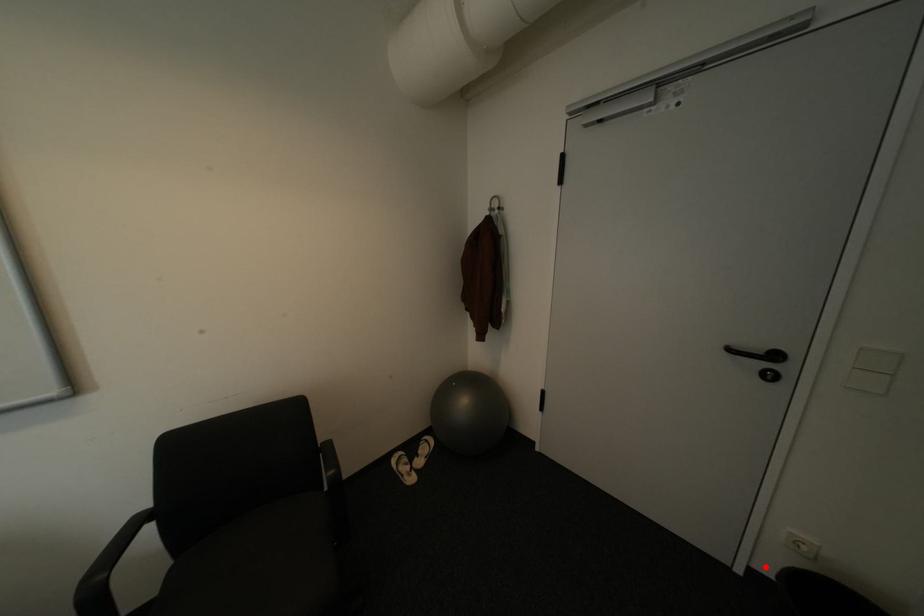
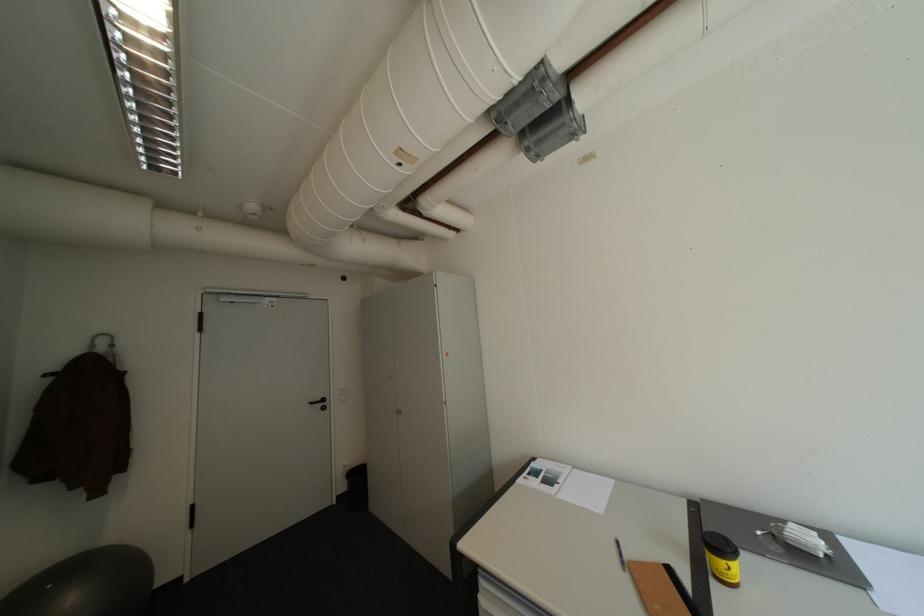
Question: A red point is marked in image1. In image2, is the corresponding 3D point closer to the camera or farther? Reply with the corresponding letter.

Choices:
 (A) The corresponding 3D point is closer.
 (B) The corresponding 3D point is farther.

Answer: (B)